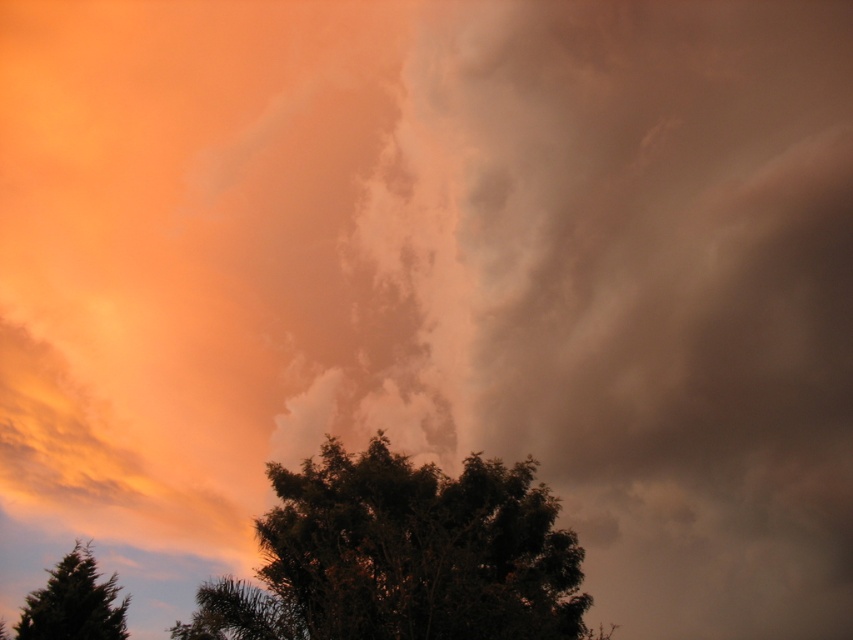
Can you confirm if green leafy tree at lower center is smaller than green matte tree at lower left?

Incorrect, green leafy tree at lower center is not smaller in size than green matte tree at lower left.

Between green leafy tree at lower center and green matte tree at lower left, which one appears on the right side from the viewer's perspective?

green leafy tree at lower center is more to the right.

Is point (254, 608) behind point (100, 602)?

No, (254, 608) is closer to viewer.

Where is `green leafy tree at lower center`? Image resolution: width=853 pixels, height=640 pixels. green leafy tree at lower center is located at coordinates (402, 556).